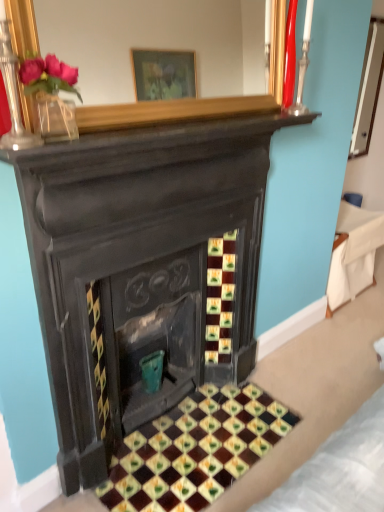
Question: Would you say white fabric at right is a long distance from teal ceramic vase at center?

Choices:
 (A) yes
 (B) no

Answer: (A)

Question: Does white fabric at right come behind teal ceramic vase at center?

Choices:
 (A) yes
 (B) no

Answer: (A)

Question: Is white fabric at right closer to the viewer compared to teal ceramic vase at center?

Choices:
 (A) yes
 (B) no

Answer: (B)

Question: Is teal ceramic vase at center surrounded by white fabric at right?

Choices:
 (A) no
 (B) yes

Answer: (A)

Question: From the image's perspective, is white fabric at right beneath teal ceramic vase at center?

Choices:
 (A) yes
 (B) no

Answer: (B)

Question: From the image's perspective, is white fabric at right over teal ceramic vase at center?

Choices:
 (A) yes
 (B) no

Answer: (A)

Question: From a real-world perspective, is glazed ceramic tiles at center located beneath teal ceramic vase at center?

Choices:
 (A) no
 (B) yes

Answer: (B)

Question: From the image's perspective, would you say glazed ceramic tiles at center is positioned over teal ceramic vase at center?

Choices:
 (A) no
 (B) yes

Answer: (A)

Question: Is teal ceramic vase at center a part of glazed ceramic tiles at center?

Choices:
 (A) no
 (B) yes

Answer: (A)

Question: Is glazed ceramic tiles at center outside teal ceramic vase at center?

Choices:
 (A) yes
 (B) no

Answer: (A)

Question: Considering the relative sizes of glazed ceramic tiles at center and teal ceramic vase at center in the image provided, is glazed ceramic tiles at center shorter than teal ceramic vase at center?

Choices:
 (A) yes
 (B) no

Answer: (A)

Question: Is glazed ceramic tiles at center bigger than teal ceramic vase at center?

Choices:
 (A) yes
 (B) no

Answer: (A)

Question: Does teal ceramic vase at center have a lesser width compared to white fabric at right?

Choices:
 (A) yes
 (B) no

Answer: (A)